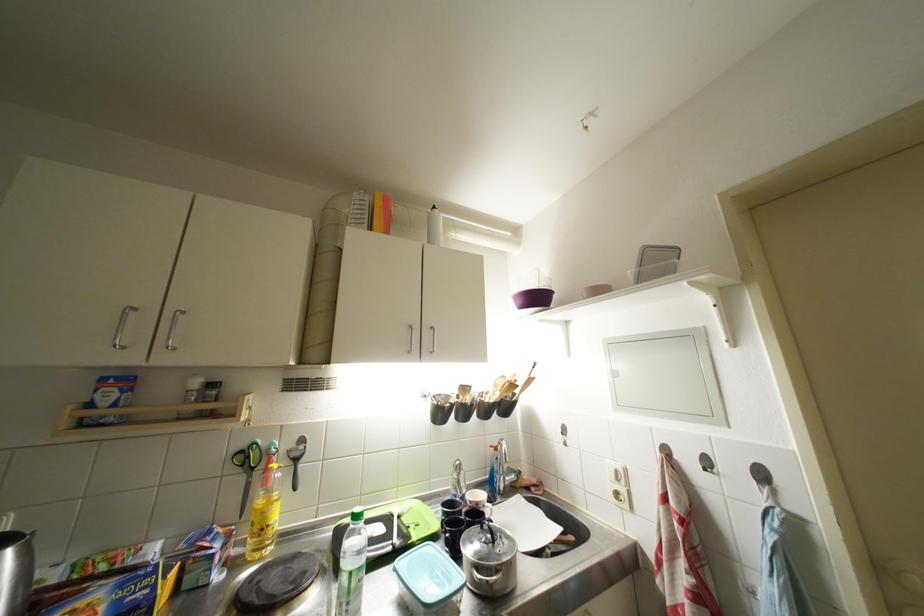
Locate an element on the screen. metal pot side handle is located at coordinates (122, 326).